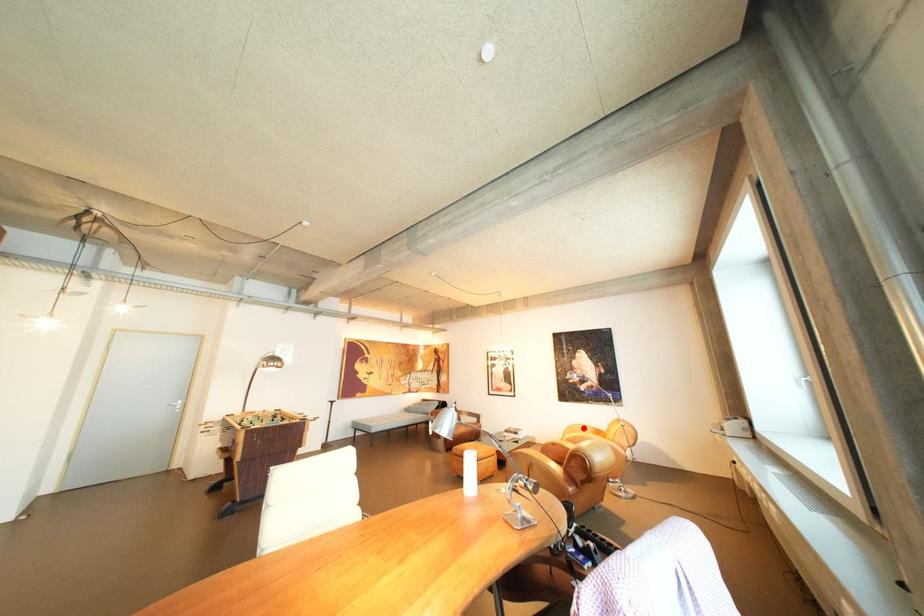
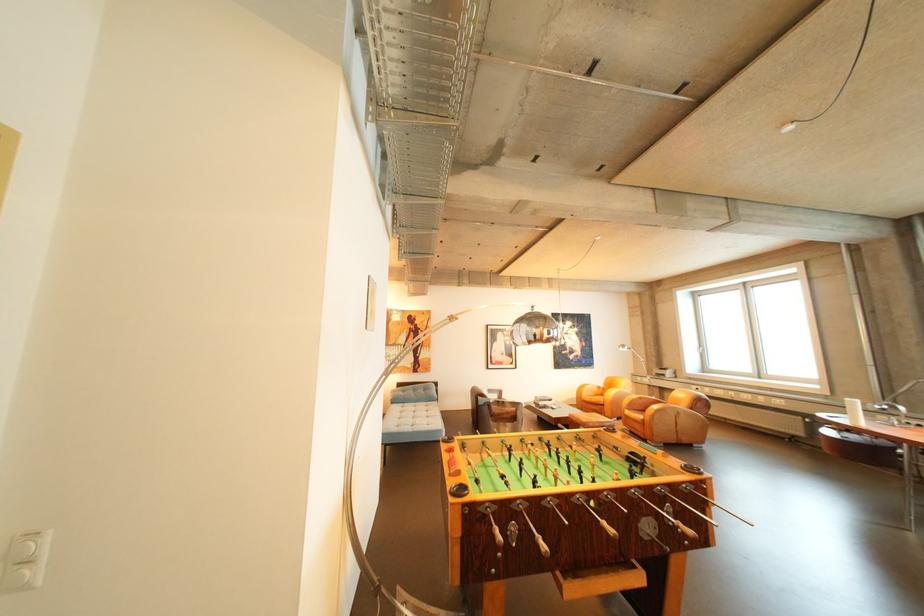
Question: I am providing you with two images of the same scene from different viewpoints. A red point is shown in image1. For the corresponding object point in image2, is it positioned nearer or farther from the camera?

Choices:
 (A) Nearer
 (B) Farther

Answer: (A)